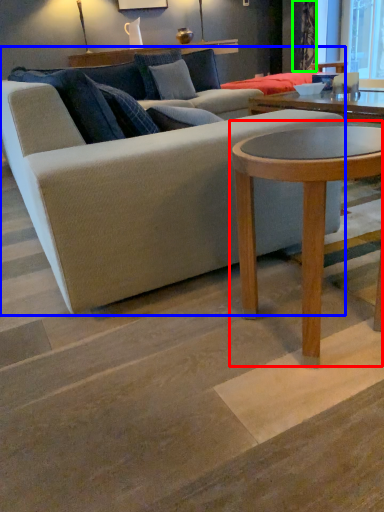
Question: Which object is positioned closest to coffee table (highlighted by a red box)? Select from studio couch (highlighted by a blue box) and curtain (highlighted by a green box).

Choices:
 (A) studio couch
 (B) curtain

Answer: (A)